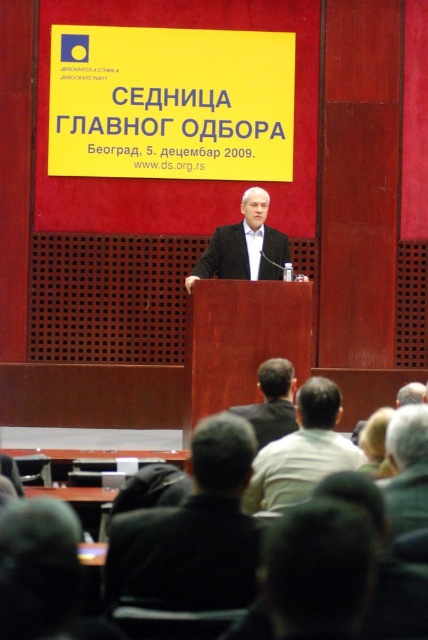
You are attending the Main Board Meeting and notice a black leather jacket at center. Where exactly is the black leather jacket positioned in the room?

The black leather jacket at center is located at point coordinates of 0.833 on the x axis and 0.451 on the y axis.

You are a photographer at the event and want to take a closeup of the speaker. You have a camera with a zoom lens. The black leather jacket at center and dark brown hair at center are both in your viewfinder. Which object should you zoom in on to focus on the speaker?

You should zoom in on the dark brown hair at center because it is farther from the viewer than the black leather jacket at center, so focusing on it will ensure the speaker is in focus.

You are taking a photo of the stage during the event. You notice two points marked in the scene. Which point, point 1 at coordinates point (x=211, y=600) or point 2 at coordinates point (x=262, y=417), will appear larger in your photo?

Point 1 at coordinates point (x=211, y=600) will appear larger in the photo because it is closer to the camera than point 2 at coordinates point (x=262, y=417).